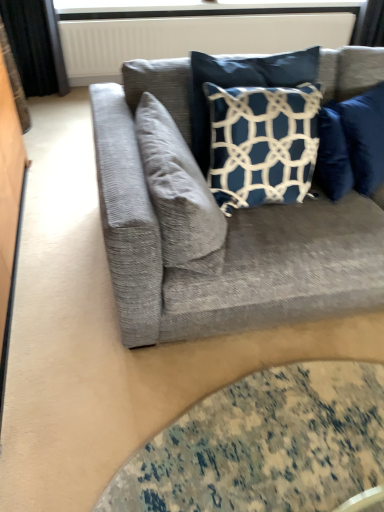
Question: Is white textured radiator at upper center facing towards textured gray couch at center?

Choices:
 (A) no
 (B) yes

Answer: (B)

Question: Is white textured radiator at upper center turned away from textured gray couch at center?

Choices:
 (A) yes
 (B) no

Answer: (B)

Question: Is white textured radiator at upper center further to camera compared to textured gray couch at center?

Choices:
 (A) yes
 (B) no

Answer: (A)

Question: Does white textured radiator at upper center have a larger size compared to textured gray couch at center?

Choices:
 (A) no
 (B) yes

Answer: (A)

Question: From the image's perspective, does white textured radiator at upper center appear higher than textured gray couch at center?

Choices:
 (A) no
 (B) yes

Answer: (B)

Question: Can you confirm if white textured radiator at upper center is positioned to the left of textured gray couch at center?

Choices:
 (A) no
 (B) yes

Answer: (B)

Question: Can you confirm if transparent glass table at lower center is shorter than textured gray couch at center?

Choices:
 (A) no
 (B) yes

Answer: (B)

Question: From the image's perspective, is transparent glass table at lower center located above textured gray couch at center?

Choices:
 (A) no
 (B) yes

Answer: (A)

Question: Is transparent glass table at lower center positioned with its back to textured gray couch at center?

Choices:
 (A) yes
 (B) no

Answer: (A)

Question: Is the surface of transparent glass table at lower center in direct contact with textured gray couch at center?

Choices:
 (A) yes
 (B) no

Answer: (B)

Question: Considering the relative sizes of transparent glass table at lower center and textured gray couch at center in the image provided, is transparent glass table at lower center bigger than textured gray couch at center?

Choices:
 (A) yes
 (B) no

Answer: (B)

Question: Is transparent glass table at lower center further to camera compared to textured gray couch at center?

Choices:
 (A) yes
 (B) no

Answer: (A)

Question: From a real-world perspective, is white plastic window screen at upper center beneath white textured radiator at upper center?

Choices:
 (A) no
 (B) yes

Answer: (A)